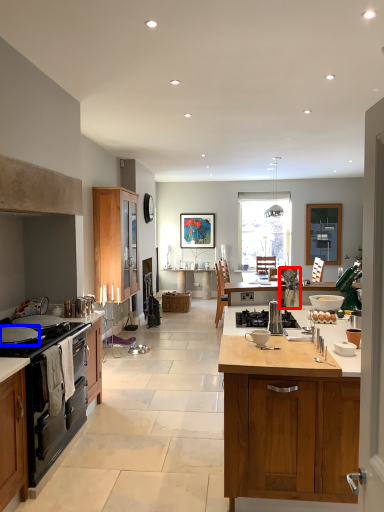
Question: Which point is further to the camera, appliance (highlighted by a red box) or kitchen appliance (highlighted by a blue box)?

Choices:
 (A) appliance
 (B) kitchen appliance

Answer: (A)